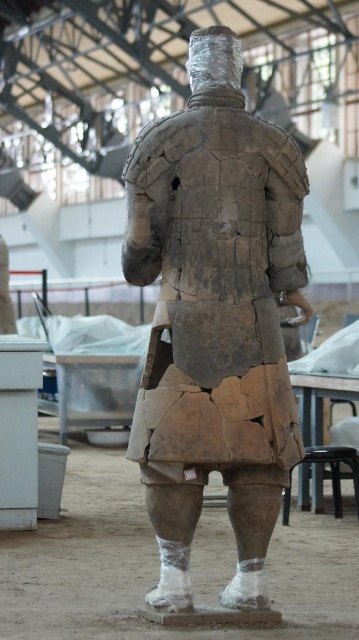
You are a conservator working in a workshop. You need to examine the cracked clay armor at center. If your arm reaches 2.5 meters, can you touch it without moving?

The cracked clay armor at center is 2.49 meters away from the viewer. Since your arm can reach 2.5 meters, you can just barely touch it without moving.

You are an archaeologist examining the terracotta warrior statue in the workshop. You notice a specific point marked at coordinates (215,317). What object is located at this point on the statue?

The point at (215,317) is where the cracked clay armor at center is located.

You are a conservator working in the workshop. You need to move the black plastic stool at lower right to another part of the room. Can you lift the stool without moving the cracked clay armor at center?

The cracked clay armor at center is positioned over black plastic stool at lower right, so lifting the stool may disturb the armor. It is advisable to first carefully remove the cracked clay armor at center before moving the stool to avoid damage.